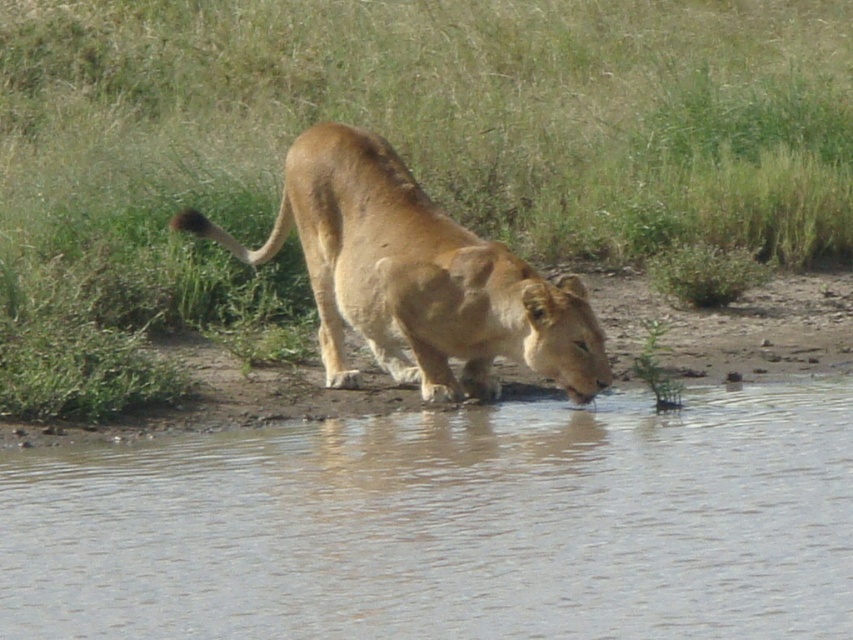
Can you confirm if clear water at lower center is bigger than golden fur lion at center?

Correct, clear water at lower center is larger in size than golden fur lion at center.

Can you confirm if clear water at lower center is positioned above golden fur lion at center?

No.

This screenshot has height=640, width=853. Identify the location of clear water at lower center. (450, 524).